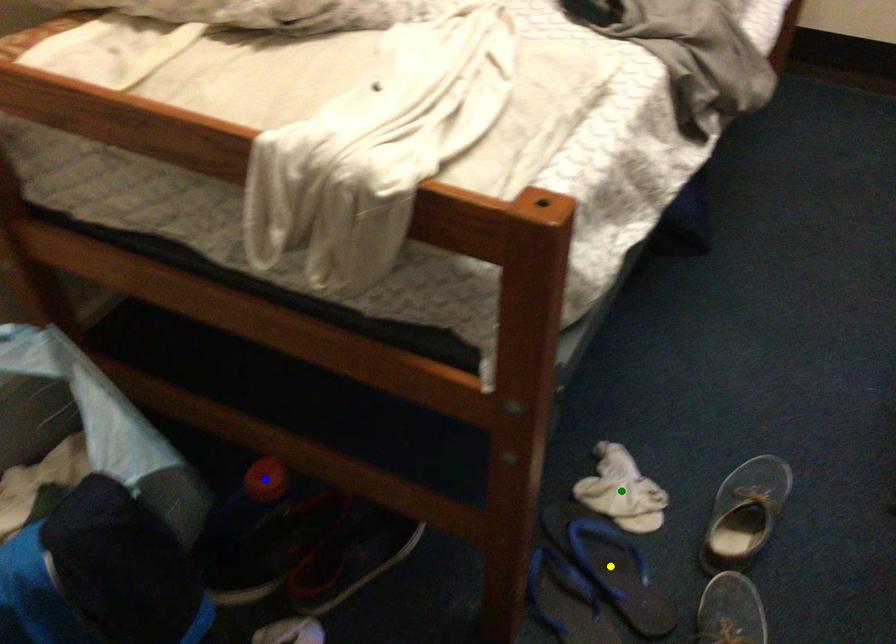
Order these from nearest to farthest:
blue point
yellow point
green point

blue point → yellow point → green point